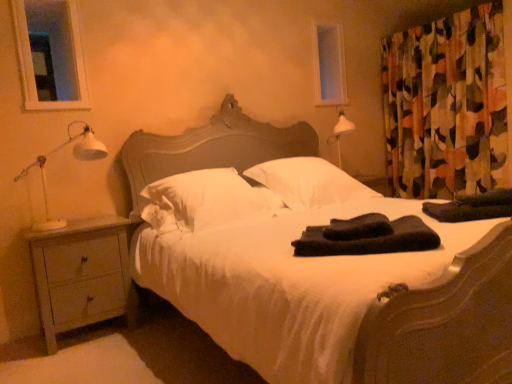
Question: Is transparent glass window screen at upper center, which is the 2th window screen in front-to-back order, to the right of white matte table lamp at left from the viewer's perspective?

Choices:
 (A) yes
 (B) no

Answer: (A)

Question: From the image's perspective, is transparent glass window screen at upper center, which is the 2th window screen in front-to-back order, under white matte table lamp at left?

Choices:
 (A) yes
 (B) no

Answer: (B)

Question: Is transparent glass window screen at upper center, which is the second window screen from left to right, facing towards white matte table lamp at left?

Choices:
 (A) yes
 (B) no

Answer: (B)

Question: From the image's perspective, is transparent glass window screen at upper center, which is the second window screen from left to right, over white matte table lamp at left?

Choices:
 (A) no
 (B) yes

Answer: (B)

Question: Is transparent glass window screen at upper center, acting as the first window screen starting from the back, further to the viewer compared to white matte table lamp at left?

Choices:
 (A) yes
 (B) no

Answer: (A)

Question: Is transparent glass window screen at upper center, acting as the first window screen starting from the back, looking in the opposite direction of white matte table lamp at left?

Choices:
 (A) no
 (B) yes

Answer: (A)

Question: Is white soft pillow at center, arranged as the 2th pillow when viewed from the left, to the left of transparent glass window at upper left, the 2th window screen positioned from the right, from the viewer's perspective?

Choices:
 (A) no
 (B) yes

Answer: (A)

Question: Is white soft pillow at center, arranged as the 2th pillow when viewed from the left, at the right side of transparent glass window at upper left, which is the second window screen in back-to-front order?

Choices:
 (A) yes
 (B) no

Answer: (A)

Question: Is white soft pillow at center, arranged as the 2th pillow when viewed from the left, surrounding transparent glass window at upper left, the 2th window screen positioned from the right?

Choices:
 (A) no
 (B) yes

Answer: (A)

Question: From a real-world perspective, is white soft pillow at center, arranged as the 2th pillow when viewed from the left, below transparent glass window at upper left, the 2th window screen positioned from the right?

Choices:
 (A) yes
 (B) no

Answer: (A)

Question: Is white soft pillow at center, which appears as the 1th pillow when viewed from the right, positioned with its back to transparent glass window at upper left, the first window screen viewed from the left?

Choices:
 (A) yes
 (B) no

Answer: (B)

Question: Is white soft pillow at center, which appears as the 1th pillow when viewed from the right, facing towards transparent glass window at upper left, the 2th window screen positioned from the right?

Choices:
 (A) yes
 (B) no

Answer: (B)

Question: Does black soft towels at center, the 1th material positioned from the front, appear on the left side of white soft pillow at center, which is the 2th pillow in right-to-left order?

Choices:
 (A) no
 (B) yes

Answer: (A)